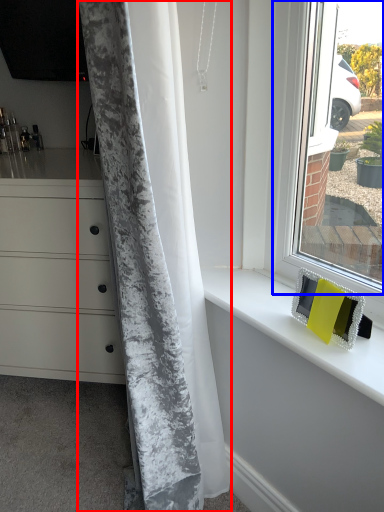
Question: Among these objects, which one is farthest to the camera, curtain (highlighted by a red box) or window (highlighted by a blue box)?

Choices:
 (A) curtain
 (B) window

Answer: (B)